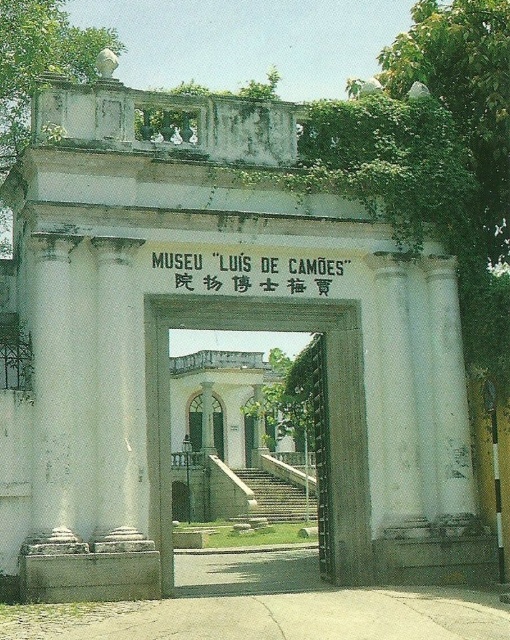
From the picture: You are standing at the entrance of the Museu Lu? de Cam?es in Macau. You see a point marked at coordinates (326, 406). What does this point indicate?

The point marked at coordinates (326, 406) indicates the location of the stone gate at center.

You are a visitor approaching the entrance of the Museu Lu?s de Cam?es. You see the stone gate at center and the white paper sign at center. Which object is located higher up?

The white paper sign at center is higher up because the stone gate at center is positioned under it.

Based on the photo, you are visiting the Museu Lu? de Cam?es in Macau and notice the stone gate at center and the white paper sign at center. Which object is taller?

The stone gate at center is taller than the white paper sign at center.